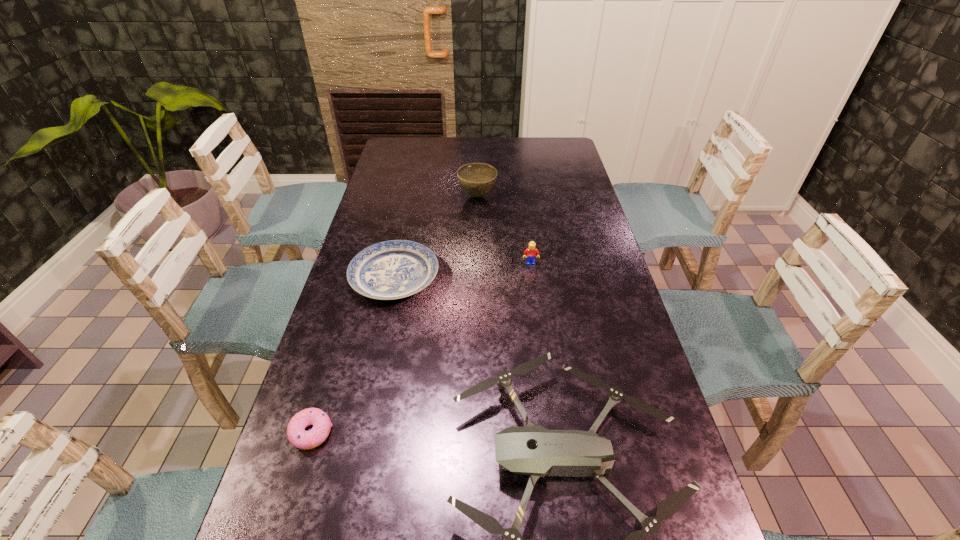
The image size is (960, 540). I want to click on doughnut at the left edge, so click(297, 436).

Find the location of a particular element. The height and width of the screenshot is (540, 960). blank space at the far edge of the desktop is located at coordinates 473,147.

Identify the location of vacant region at the left edge of the desktop. Image resolution: width=960 pixels, height=540 pixels. (x=383, y=173).

What are the coordinates of `free space at the right edge of the desktop` in the screenshot? It's located at (570, 278).

Locate an element on the screen. This screenshot has height=540, width=960. vacant space in between the tallest object and the Lego is located at coordinates (504, 230).

Locate an element on the screen. This screenshot has height=540, width=960. vacant point located between the plate and the bowl is located at coordinates (436, 237).

At what (x,y) coordinates should I click in order to perform the action: click on empty space between the bowl and the Lego. Please return your answer as a coordinate pair (x, y). Looking at the image, I should click on (504, 230).

You are a GUI agent. You are given a task and a screenshot of the screen. Output one action in this format:
    pyautogui.click(x=<x>, y=<y>)
    Task: Click on the free space between the farthest object and the Lego
    Image resolution: width=960 pixels, height=540 pixels.
    Given the screenshot: What is the action you would take?
    pyautogui.click(x=504, y=230)

Locate an element on the screen. Image resolution: width=960 pixels, height=540 pixels. blank region between the bowl and the plate is located at coordinates (436, 237).

Identify the location of the closest object to the third shortest object. (394, 269).